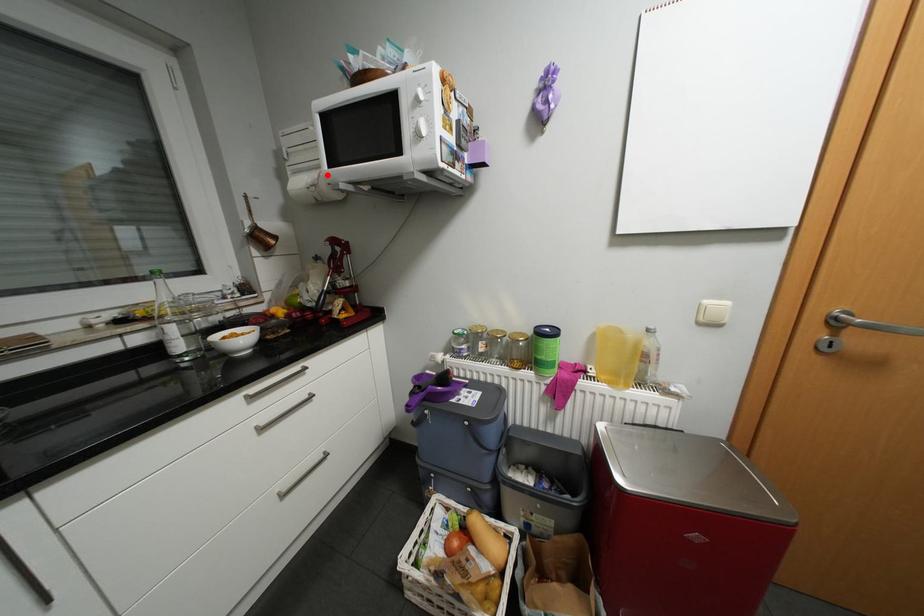
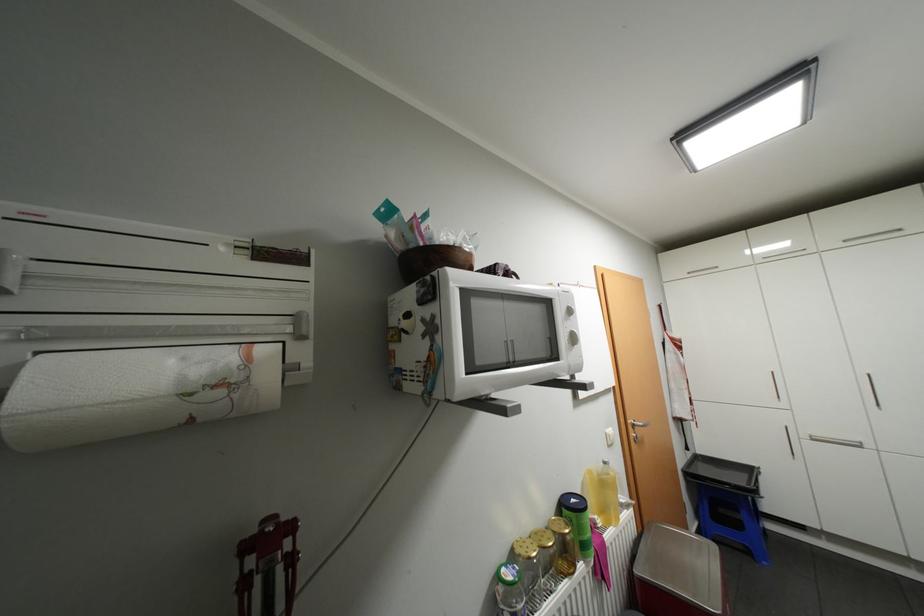
The point at the highlighted location is marked in the first image. Where is the corresponding point in the second image?

(256, 358)